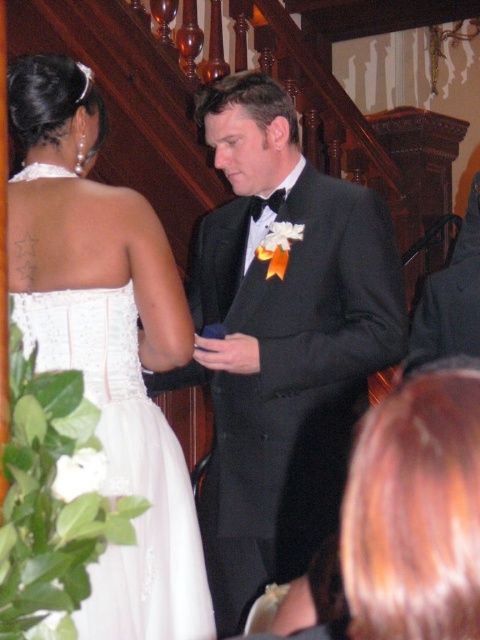
Question: Is black satin tuxedo at center to the right of white lace dress at upper left from the viewer's perspective?

Choices:
 (A) no
 (B) yes

Answer: (B)

Question: Which of the following is the closest to the observer?

Choices:
 (A) black satin tuxedo at center
 (B) white lace dress at upper left

Answer: (B)

Question: Is black satin tuxedo at center above white lace dress at upper left?

Choices:
 (A) no
 (B) yes

Answer: (A)

Question: Does black satin tuxedo at center have a lesser width compared to white lace dress at upper left?

Choices:
 (A) yes
 (B) no

Answer: (B)

Question: Which point is farther to the camera?

Choices:
 (A) (232, 176)
 (B) (166, 440)

Answer: (A)